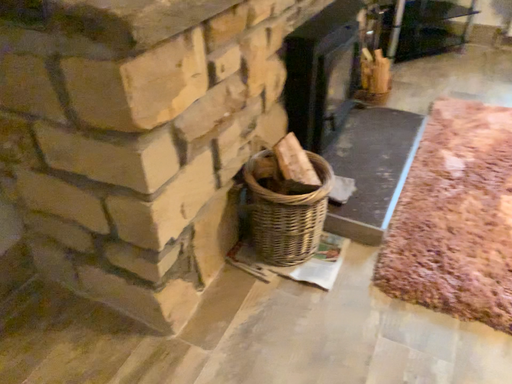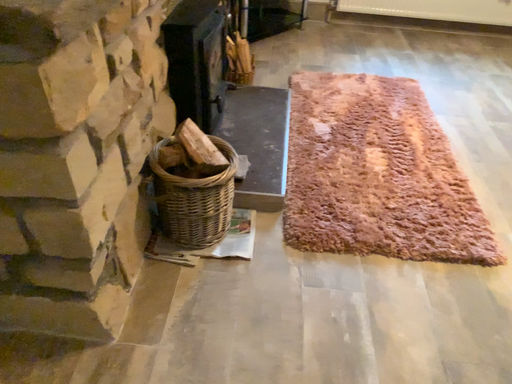
Question: Which way did the camera rotate in the video?

Choices:
 (A) rotated left
 (B) rotated right

Answer: (B)